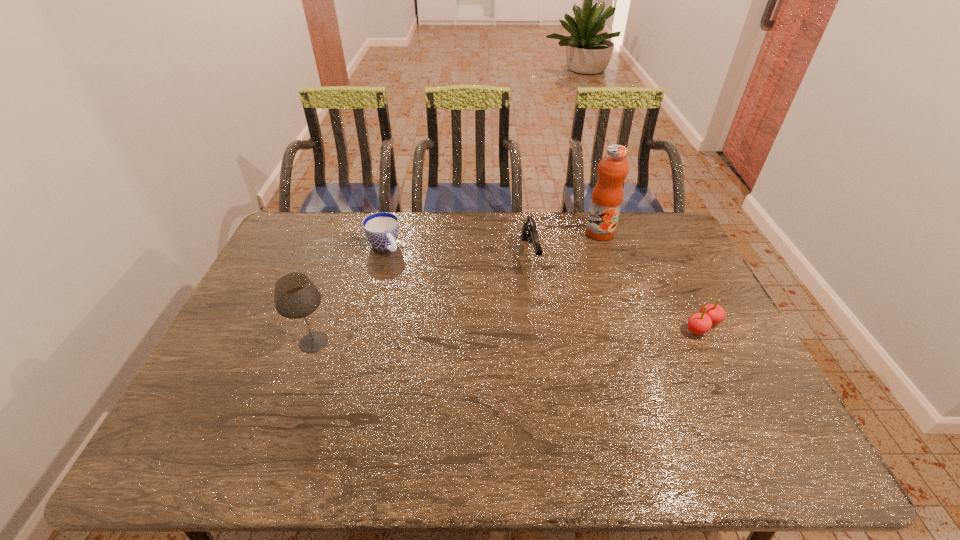
Find the location of a particular element. The height and width of the screenshot is (540, 960). vacant area that lies between the second tallest object and the cherry is located at coordinates (509, 334).

This screenshot has width=960, height=540. I want to click on vacant space that's between the rightmost object and the gun, so click(616, 291).

The width and height of the screenshot is (960, 540). What are the coordinates of `vacant space in between the leftmost object and the cherry` in the screenshot? It's located at (509, 334).

Image resolution: width=960 pixels, height=540 pixels. I want to click on free space between the rightmost object and the third tallest object, so click(x=616, y=291).

The image size is (960, 540). I want to click on free spot between the cherry and the fruit juice, so click(x=651, y=280).

Locate an element on the screen. This screenshot has height=540, width=960. vacant point located between the cup and the second tallest object is located at coordinates (348, 294).

Locate an element on the screen. Image resolution: width=960 pixels, height=540 pixels. empty space between the leftmost object and the second object from right to left is located at coordinates (457, 287).

The width and height of the screenshot is (960, 540). What are the coordinates of `free space between the fruit juice and the third object from left to right` in the screenshot? It's located at (564, 244).

Image resolution: width=960 pixels, height=540 pixels. In order to click on blank region between the fruit juice and the fourth object from right to left in this screenshot , I will do `click(492, 239)`.

The image size is (960, 540). What are the coordinates of `object that is the second closest to the fourth shortest object` in the screenshot? It's located at (529, 231).